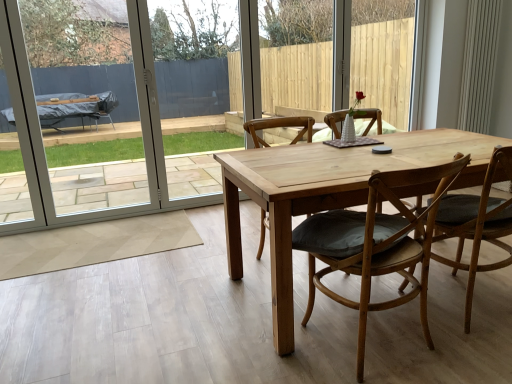
Question: Is white plastic screen door at left wider or thinner than light brown wooden chair at center, placed as the third chair when sorted from right to left?

Choices:
 (A) thin
 (B) wide

Answer: (A)

Question: Is point (2, 231) positioned closer to the camera than point (265, 218)?

Choices:
 (A) closer
 (B) farther

Answer: (B)

Question: Which object is the farthest from the white plastic screen door at left?

Choices:
 (A) wooden chair with cushion at center, placed as the 2th chair when sorted from left to right
 (B) light brown wooden chair at center, which ranks as the 1th chair in left-to-right order
 (C) light brown wooden chair at center, which is counted as the 1th chair, starting from the right

Answer: (C)

Question: Based on their relative distances, which object is farther from the white plastic screen door at left?

Choices:
 (A) wooden chair with cushion at center, the second chair from the right
 (B) light brown wooden chair at center, placed as the third chair when sorted from right to left
 (C) light brown wooden chair at center, arranged as the third chair when viewed from the left

Answer: (C)